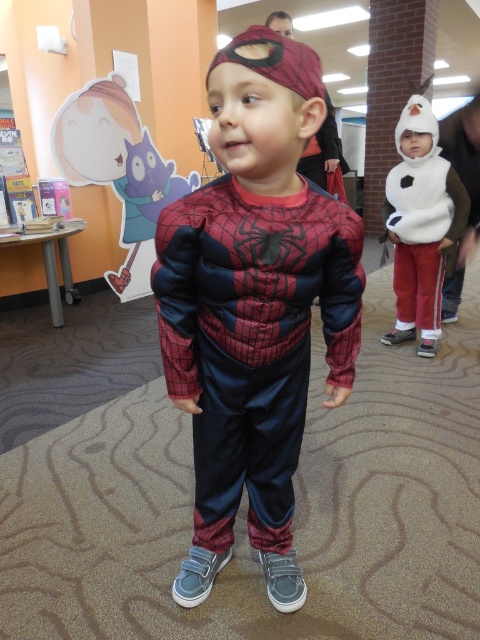
Question: Estimate the real-world distances between objects in this image. Which object is closer to the shiny satin spider-man costume at center?

Choices:
 (A) white fuzzy costume at right
 (B) matte blue plush at left

Answer: (A)

Question: Which of these objects is positioned farthest from the matte blue plush at left?

Choices:
 (A) white fuzzy costume at right
 (B) shiny satin spider-man costume at center

Answer: (B)

Question: Does shiny satin spider-man costume at center appear on the right side of matte blue plush at left?

Choices:
 (A) no
 (B) yes

Answer: (B)

Question: Is the position of shiny satin spider-man costume at center less distant than that of matte blue plush at left?

Choices:
 (A) yes
 (B) no

Answer: (A)

Question: Which point is closer to the camera?

Choices:
 (A) (210, 68)
 (B) (420, 288)
 (C) (133, 246)

Answer: (A)

Question: Can you confirm if matte blue plush at left is wider than white fuzzy costume at right?

Choices:
 (A) no
 (B) yes

Answer: (B)